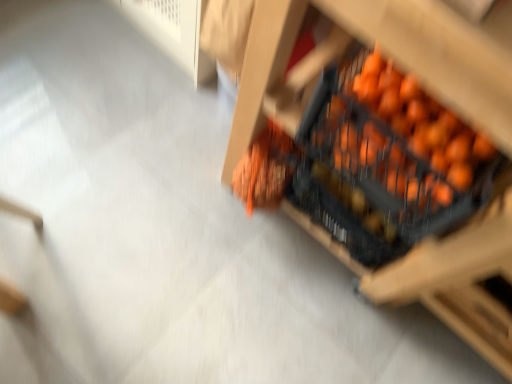
This screenshot has width=512, height=384. What are the coordinates of `orange matte crate at center` in the screenshot? It's located at (392, 155).

The width and height of the screenshot is (512, 384). What do you see at coordinates (392, 155) in the screenshot?
I see `orange matte crate at center` at bounding box center [392, 155].

What do you see at coordinates (398, 146) in the screenshot?
I see `orange matte crate at center-right` at bounding box center [398, 146].

In order to face orange matte crate at center-right, should I rotate leftwards or rightwards?

You should rotate right by 21.326 degrees.

Measure the distance between point (487,161) and camera.

Point (487,161) is 75.00 centimeters from camera.

I want to click on orange matte crate at center-right, so (398, 146).

Where is `orange matte crate at center`? This screenshot has width=512, height=384. orange matte crate at center is located at coordinates (392, 155).

Considering the relative positions of orange matte crate at center-right and orange matte crate at center in the image provided, is orange matte crate at center-right to the left or to the right of orange matte crate at center?

From the image, it's evident that orange matte crate at center-right is to the left of orange matte crate at center.

Looking at this image, which is in front, orange matte crate at center-right or orange matte crate at center?

orange matte crate at center is more forward.

Is point (359, 160) positioned before point (496, 310)?

That is True.

From the image's perspective, is orange matte crate at center-right above or below orange matte crate at center?

From the image's perspective, orange matte crate at center-right appears below orange matte crate at center.

From a real-world perspective, is orange matte crate at center-right below orange matte crate at center?

Incorrect, from a real-world perspective, orange matte crate at center-right is higher than orange matte crate at center.

Considering the sizes of orange matte crate at center-right and orange matte crate at center in the image, is orange matte crate at center-right wider or thinner than orange matte crate at center?

In the image, orange matte crate at center-right appears to be more narrow than orange matte crate at center.

From their relative heights in the image, would you say orange matte crate at center-right is taller or shorter than orange matte crate at center?

Clearly, orange matte crate at center-right is shorter compared to orange matte crate at center.

Is orange matte crate at center-right smaller than orange matte crate at center?

Yes.

Choose the correct answer: Is orange matte crate at center-right inside orange matte crate at center or outside it?

orange matte crate at center-right lies within the bounds of orange matte crate at center.

Is orange matte crate at center-right positioned far away from orange matte crate at center?

That's not correct — orange matte crate at center-right is a little close to orange matte crate at center.

From the picture: Is orange matte crate at center-right oriented away from orange matte crate at center?

Correct, orange matte crate at center-right is looking away from orange matte crate at center.

Where is `fruit on the left of orange matte crate at center`? fruit on the left of orange matte crate at center is located at coordinates (398, 146).

Considering the relative positions of orange matte crate at center and orange matte crate at center-right in the image provided, is orange matte crate at center to the left or to the right of orange matte crate at center-right?

From the image, it's evident that orange matte crate at center is to the right of orange matte crate at center-right.

Is the position of orange matte crate at center more distant than that of orange matte crate at center-right?

No, it is in front of orange matte crate at center-right.

Is point (509, 3) closer or farther from the camera than point (417, 232)?

Clearly, point (509, 3) is closer to the camera than point (417, 232).

From the image's perspective, is orange matte crate at center located above or below orange matte crate at center-right?

Based on their image positions, orange matte crate at center is located above orange matte crate at center-right.

From a real-world perspective, relative to orange matte crate at center-right, is orange matte crate at center vertically above or below?

From a real-world perspective, orange matte crate at center is physically below orange matte crate at center-right.

Is orange matte crate at center wider than orange matte crate at center-right?

Correct, the width of orange matte crate at center exceeds that of orange matte crate at center-right.

In the scene shown: Can you confirm if orange matte crate at center is taller than orange matte crate at center-right?

Yes, orange matte crate at center is taller than orange matte crate at center-right.

Can you confirm if orange matte crate at center is smaller than orange matte crate at center-right?

Incorrect, orange matte crate at center is not smaller in size than orange matte crate at center-right.

Is orange matte crate at center situated inside orange matte crate at center-right or outside?

orange matte crate at center is outside orange matte crate at center-right.

Is there a large distance between orange matte crate at center and orange matte crate at center-right?

Actually, orange matte crate at center and orange matte crate at center-right are a little close together.

Is orange matte crate at center oriented towards orange matte crate at center-right?

Yes.

Image resolution: width=512 pixels, height=384 pixels. What are the coordinates of `fruit above the orange matte crate at center (from a real-world perspective)` in the screenshot? It's located at (398, 146).

The height and width of the screenshot is (384, 512). I want to click on fruit above the orange matte crate at center (from a real-world perspective), so click(x=398, y=146).

You are a GUI agent. You are given a task and a screenshot of the screen. Output one action in this format:
    pyautogui.click(x=<x>, y=<y>)
    Task: Click on the furniture above the orange matte crate at center-right (from the image's perspective)
    
    Given the screenshot: What is the action you would take?
    pyautogui.click(x=392, y=155)